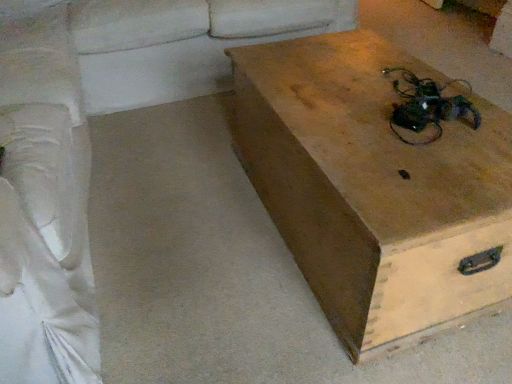
Question: From a real-world perspective, is smooth beige couch at lower left on white fabric couch at left, which ranks as the 1th couch in left-to-right order?

Choices:
 (A) no
 (B) yes

Answer: (A)

Question: Can you confirm if smooth beige couch at lower left is bigger than white fabric couch at left, which ranks as the 1th couch in left-to-right order?

Choices:
 (A) yes
 (B) no

Answer: (B)

Question: Considering the relative sizes of smooth beige couch at lower left and white fabric couch at left, which ranks as the 1th couch in left-to-right order, in the image provided, is smooth beige couch at lower left wider than white fabric couch at left, which ranks as the 1th couch in left-to-right order,?

Choices:
 (A) no
 (B) yes

Answer: (B)

Question: Is smooth beige couch at lower left further to the viewer compared to white fabric couch at left, placed as the second couch when sorted from right to left?

Choices:
 (A) yes
 (B) no

Answer: (A)

Question: Does smooth beige couch at lower left appear on the left side of white fabric couch at left, which ranks as the 1th couch in left-to-right order?

Choices:
 (A) yes
 (B) no

Answer: (B)

Question: In terms of width, does smooth beige couch at lower left look wider or thinner when compared to wooden box at center?

Choices:
 (A) wide
 (B) thin

Answer: (A)

Question: Is smooth beige couch at lower left taller or shorter than wooden box at center?

Choices:
 (A) short
 (B) tall

Answer: (A)

Question: Does point (223, 87) appear closer or farther from the camera than point (389, 233)?

Choices:
 (A) farther
 (B) closer

Answer: (A)

Question: Choose the correct answer: Is smooth beige couch at lower left inside wooden box at center or outside it?

Choices:
 (A) inside
 (B) outside

Answer: (B)

Question: Is point (389, 188) closer or farther from the camera than point (241, 1)?

Choices:
 (A) closer
 (B) farther

Answer: (A)

Question: From the image's perspective, is wooden box at center located above or below smooth beige couch at lower left?

Choices:
 (A) below
 (B) above

Answer: (A)

Question: Is wooden box at center bigger or smaller than smooth beige couch at lower left?

Choices:
 (A) small
 (B) big

Answer: (A)

Question: From a real-world perspective, is wooden box at center above or below smooth beige couch at lower left?

Choices:
 (A) below
 (B) above

Answer: (B)

Question: Is smooth beige couch at lower left in front of or behind white fabric couch at upper left, the second couch positioned from the left, in the image?

Choices:
 (A) front
 (B) behind

Answer: (A)

Question: Looking at their shapes, would you say smooth beige couch at lower left is wider or thinner than white fabric couch at upper left, which appears as the 1th couch when viewed from the right?

Choices:
 (A) thin
 (B) wide

Answer: (B)